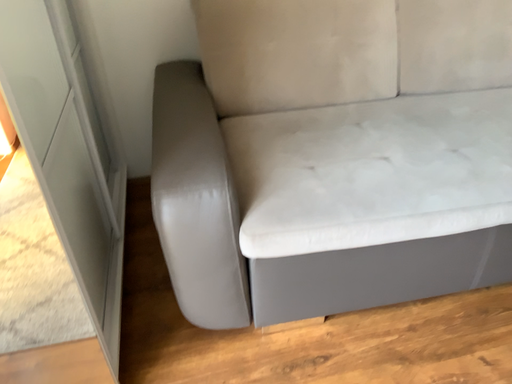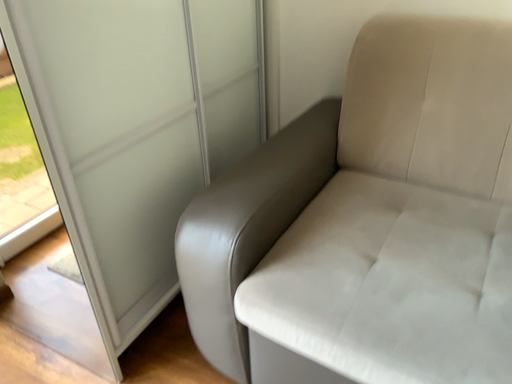
Question: Which way did the camera rotate in the video?

Choices:
 (A) rotated upward
 (B) rotated downward

Answer: (A)